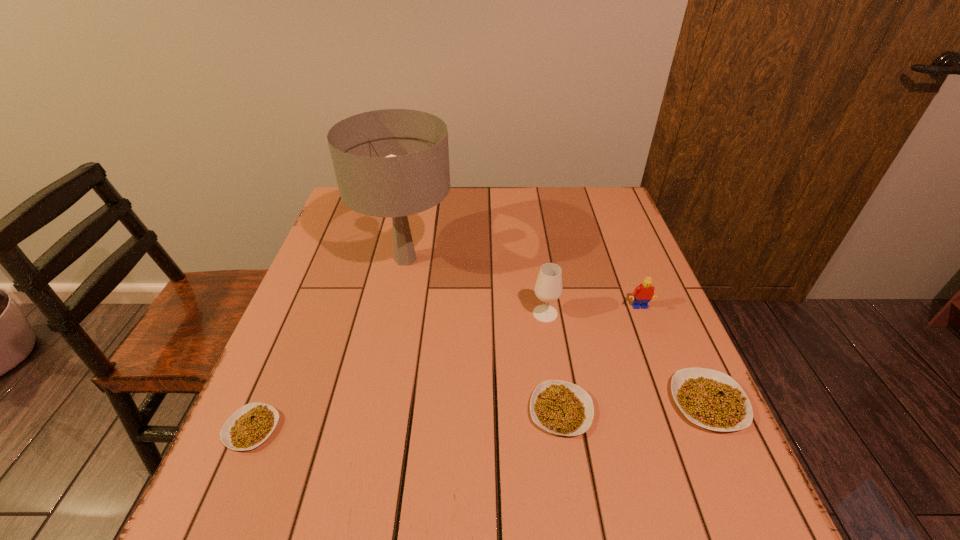
In order to click on object at the near left corner in this screenshot , I will do `click(252, 424)`.

I want to click on object present at the near right corner, so click(x=711, y=399).

In the image, there is a desktop. At what (x,y) coordinates should I click in order to perform the action: click on free region at the far edge. Please return your answer as a coordinate pair (x, y). Image resolution: width=960 pixels, height=540 pixels. Looking at the image, I should click on (490, 191).

In the image, there is a desktop. In order to click on vacant space at the near edge in this screenshot , I will do `click(599, 433)`.

You are a GUI agent. You are given a task and a screenshot of the screen. Output one action in this format:
    pyautogui.click(x=<x>, y=<y>)
    Task: Click on the free space at the left edge of the desktop
    The height and width of the screenshot is (540, 960).
    Given the screenshot: What is the action you would take?
    pyautogui.click(x=368, y=234)

Identify the location of vacant region at the right edge. (615, 356).

Find the location of `vacant space at the far left corner`. vacant space at the far left corner is located at coordinates (366, 217).

The width and height of the screenshot is (960, 540). What are the coordinates of `vacant area at the far right corner of the desktop` in the screenshot? It's located at (595, 188).

At what (x,y) coordinates should I click in order to perform the action: click on free point between the rightmost legume and the fifth object from right to left. Please return your answer as a coordinate pair (x, y). Image resolution: width=960 pixels, height=540 pixels. Looking at the image, I should click on (557, 330).

I want to click on empty space between the leftmost legume and the Lego, so click(445, 368).